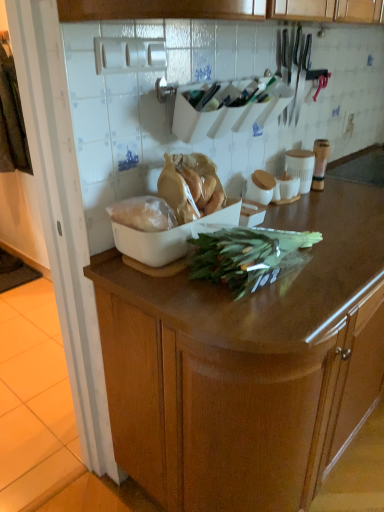
Question: From a real-world perspective, is white plastic bag at center, which is the 2th food in right-to-left order, positioned above or below translucent plastic bag at center, placed as the 2th food when sorted from left to right?

Choices:
 (A) above
 (B) below

Answer: (B)

Question: Visually, is white plastic bag at center, which ranks as the 1th food in left-to-right order, positioned to the left or to the right of translucent plastic bag at center, the first food when ordered from right to left?

Choices:
 (A) left
 (B) right

Answer: (A)

Question: Which object is positioned closest to the white plastic bag at center, which ranks as the 1th food in left-to-right order?

Choices:
 (A) wooden cabinet at center
 (B) green leafy at center
 (C) translucent plastic bag at center, the first food when ordered from right to left

Answer: (C)

Question: Considering the real-world distances, which object is farthest from the wooden cabinet at center?

Choices:
 (A) white plastic bag at center, which ranks as the 1th food in left-to-right order
 (B) green leafy at center
 (C) translucent plastic bag at center, placed as the 2th food when sorted from left to right

Answer: (A)